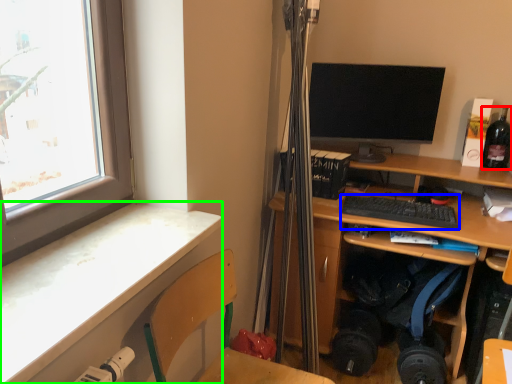
Question: Based on their relative distances, which object is nearer to bottle (highlighted by a red box)? Choose from computer keyboard (highlighted by a blue box) and desk (highlighted by a green box).

Choices:
 (A) computer keyboard
 (B) desk

Answer: (A)